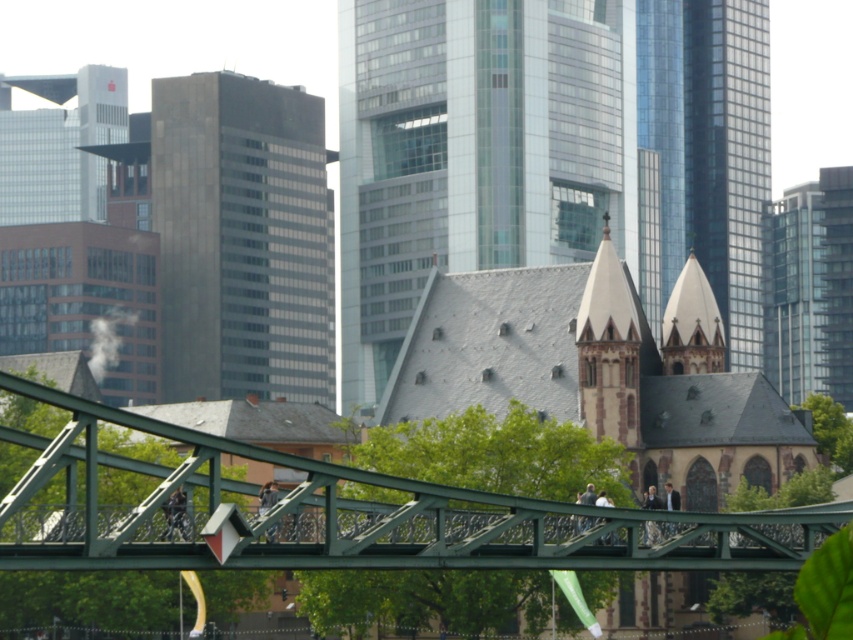
Between green metallic bridge at lower center and shiny glass tower at upper right, which one is positioned higher?

shiny glass tower at upper right

Is point (323, 515) positioned before point (753, 248)?

Yes, it is.

Between point (422, 561) and point (764, 129), which one is positioned in front?

Point (422, 561) is in front.

The image size is (853, 640). I want to click on green metallic bridge at lower center, so click(351, 516).

Does dark gray glass building at center have a lesser height compared to shiny glass tower at upper right?

Yes, dark gray glass building at center is shorter than shiny glass tower at upper right.

This screenshot has width=853, height=640. In order to click on dark gray glass building at center in this screenshot , I will do `click(242, 240)`.

Does shiny glass tower at upper right have a smaller size compared to glassy reflective skyscraper at upper right?

No.

Looking at this image, can you confirm if shiny glass tower at upper right is bigger than glassy reflective skyscraper at upper right?

Yes, shiny glass tower at upper right is bigger than glassy reflective skyscraper at upper right.

The image size is (853, 640). What do you see at coordinates (728, 157) in the screenshot? I see `shiny glass tower at upper right` at bounding box center [728, 157].

Find the location of `shiny glass tower at upper right`. shiny glass tower at upper right is located at coordinates (728, 157).